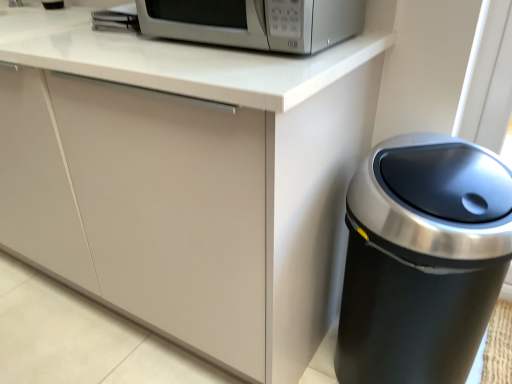
Find the location of a particular element. vacant space situated above black metallic trash can at right (from a real-world perspective) is located at coordinates (441, 186).